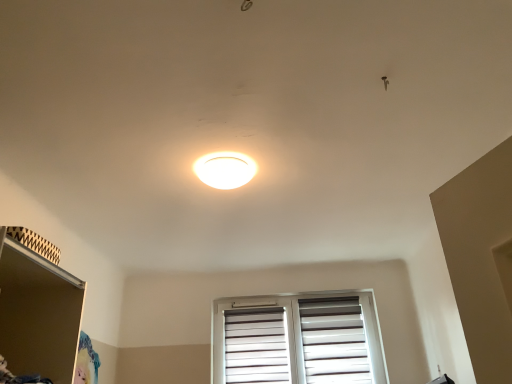
Question: Considering the relative sizes of white matte window at center and matte brown shelf at lower left in the image provided, is white matte window at center bigger than matte brown shelf at lower left?

Choices:
 (A) no
 (B) yes

Answer: (B)

Question: Considering the relative sizes of white matte window at center and matte brown shelf at lower left in the image provided, is white matte window at center taller than matte brown shelf at lower left?

Choices:
 (A) yes
 (B) no

Answer: (A)

Question: Is white matte window at center facing towards matte brown shelf at lower left?

Choices:
 (A) no
 (B) yes

Answer: (B)

Question: Can we say white matte window at center lies outside matte brown shelf at lower left?

Choices:
 (A) no
 (B) yes

Answer: (B)

Question: From a real-world perspective, is white matte window at center physically below matte brown shelf at lower left?

Choices:
 (A) no
 (B) yes

Answer: (A)

Question: Is white matte window at center surrounding matte brown shelf at lower left?

Choices:
 (A) yes
 (B) no

Answer: (B)

Question: Is white matte window at center positioned in front of white glossy ceiling light at center?

Choices:
 (A) no
 (B) yes

Answer: (A)

Question: From a real-world perspective, is white matte window at center below white glossy ceiling light at center?

Choices:
 (A) yes
 (B) no

Answer: (A)

Question: Is white matte window at center facing towards white glossy ceiling light at center?

Choices:
 (A) yes
 (B) no

Answer: (A)

Question: Can you confirm if white matte window at center is thinner than white glossy ceiling light at center?

Choices:
 (A) no
 (B) yes

Answer: (B)

Question: Does white matte window at center have a greater width compared to white glossy ceiling light at center?

Choices:
 (A) no
 (B) yes

Answer: (A)

Question: Is white matte window at center oriented away from white glossy ceiling light at center?

Choices:
 (A) no
 (B) yes

Answer: (A)

Question: Does matte brown shelf at lower left have a lesser height compared to white glossy ceiling light at center?

Choices:
 (A) no
 (B) yes

Answer: (A)